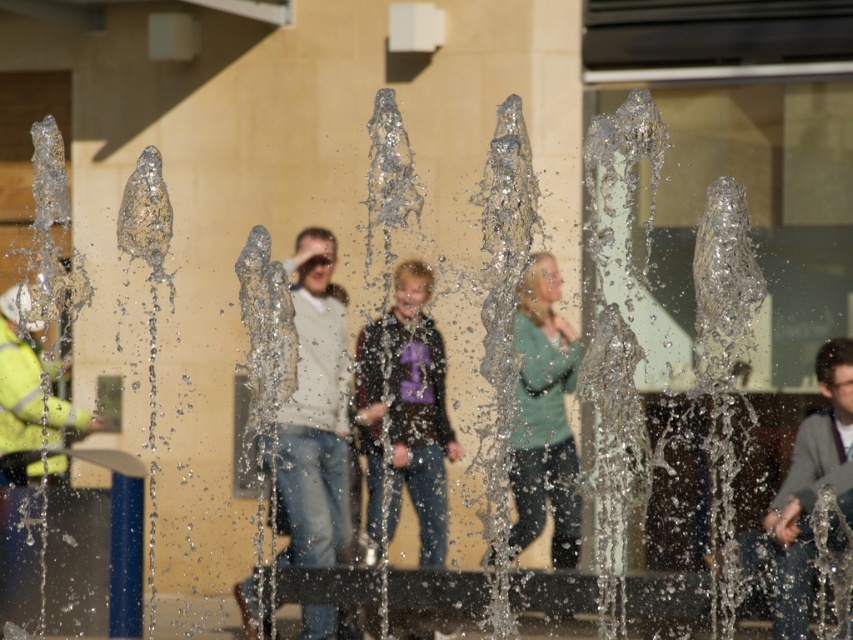
You are a fashion designer observing the scene. You notice two garments in the image. Which garment has a larger size between the matte white sweater at center and the gray fabric jacket at lower right?

The matte white sweater at center is bigger than the gray fabric jacket at lower right, so the matte white sweater at center has a larger size.

You are standing in front of the water fountain and want to locate two specific points marked in the image. The first point is at coordinates point (430, 321) and the second is at point (28, 428). Which of these points is closer to you?

Point (430, 321) is closer to the viewer than point (28, 428).

Based on the photo, you are a photographer trying to capture a clear shot of both the gray fabric jacket at lower right and the high visibility yellow jacket at left. Based on their positions, which jacket will appear closer to the bottom of your photo?

The gray fabric jacket at lower right is located below the high visibility yellow jacket at left, so it will appear closer to the bottom of the photo.